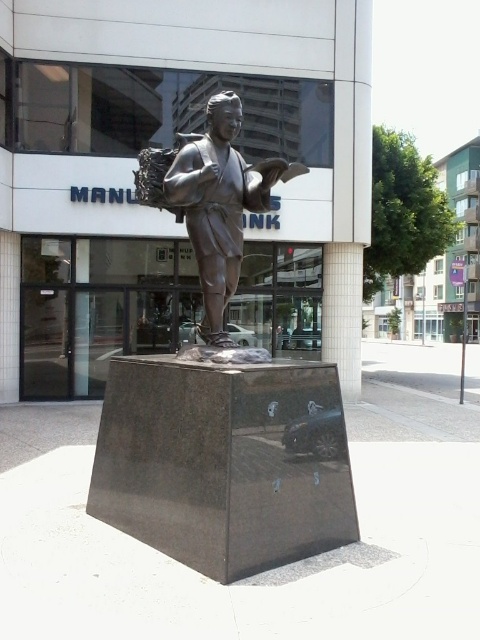
Question: Does bronze statue at center appear over smooth gray pillar at center?

Choices:
 (A) yes
 (B) no

Answer: (A)

Question: Among these objects, which one is farthest from the camera?

Choices:
 (A) bronze statue at center
 (B) smooth gray pillar at center

Answer: (B)

Question: Which of the following is the farthest from the observer?

Choices:
 (A) (356, 316)
 (B) (162, 166)

Answer: (A)

Question: Does bronze statue at center lie in front of smooth gray pillar at center?

Choices:
 (A) no
 (B) yes

Answer: (B)

Question: Does bronze statue at center appear under smooth gray pillar at center?

Choices:
 (A) yes
 (B) no

Answer: (B)